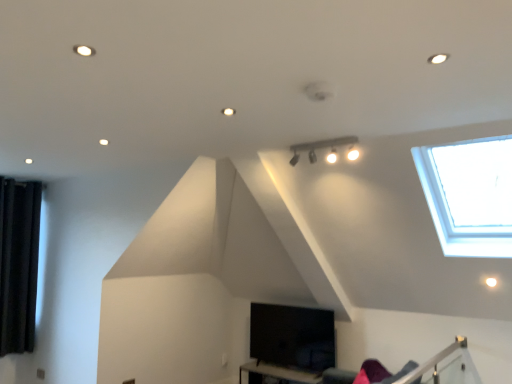
Question: Is black velvet curtain at left wider than black matte table at lower center?

Choices:
 (A) yes
 (B) no

Answer: (B)

Question: Can you confirm if black velvet curtain at left is positioned to the right of black matte table at lower center?

Choices:
 (A) no
 (B) yes

Answer: (A)

Question: From the image's perspective, is black velvet curtain at left on black matte table at lower center?

Choices:
 (A) yes
 (B) no

Answer: (A)

Question: Can black matte table at lower center be found inside black velvet curtain at left?

Choices:
 (A) no
 (B) yes

Answer: (A)

Question: Is black velvet curtain at left positioned beyond the bounds of black matte table at lower center?

Choices:
 (A) no
 (B) yes

Answer: (B)

Question: Considering the relative sizes of black velvet curtain at left and black matte table at lower center in the image provided, is black velvet curtain at left taller than black matte table at lower center?

Choices:
 (A) no
 (B) yes

Answer: (B)

Question: From a real-world perspective, is matte black track lighting at upper center physically below black velvet curtain at left?

Choices:
 (A) yes
 (B) no

Answer: (B)

Question: Is matte black track lighting at upper center positioned far away from black velvet curtain at left?

Choices:
 (A) no
 (B) yes

Answer: (B)

Question: From a real-world perspective, does matte black track lighting at upper center stand above black velvet curtain at left?

Choices:
 (A) no
 (B) yes

Answer: (B)

Question: Considering the relative sizes of matte black track lighting at upper center and black velvet curtain at left in the image provided, is matte black track lighting at upper center shorter than black velvet curtain at left?

Choices:
 (A) yes
 (B) no

Answer: (A)

Question: Is matte black track lighting at upper center facing away from black velvet curtain at left?

Choices:
 (A) yes
 (B) no

Answer: (B)

Question: From the image's perspective, does matte black track lighting at upper center appear higher than black velvet curtain at left?

Choices:
 (A) no
 (B) yes

Answer: (B)

Question: Can you confirm if matte black track lighting at upper center is taller than black matte table at lower center?

Choices:
 (A) yes
 (B) no

Answer: (B)